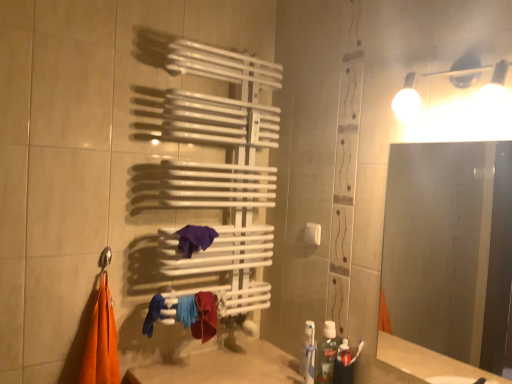
Question: Does frosted glass mirror at right have a smaller size compared to blue fabric at lower center?

Choices:
 (A) yes
 (B) no

Answer: (B)

Question: Considering the relative sizes of frosted glass mirror at right and blue fabric at lower center in the image provided, is frosted glass mirror at right bigger than blue fabric at lower center?

Choices:
 (A) no
 (B) yes

Answer: (B)

Question: Considering the relative sizes of frosted glass mirror at right and blue fabric at lower center in the image provided, is frosted glass mirror at right wider than blue fabric at lower center?

Choices:
 (A) yes
 (B) no

Answer: (B)

Question: Is frosted glass mirror at right thinner than blue fabric at lower center?

Choices:
 (A) no
 (B) yes

Answer: (B)

Question: From a real-world perspective, is frosted glass mirror at right located higher than blue fabric at lower center?

Choices:
 (A) no
 (B) yes

Answer: (B)

Question: Is frosted glass mirror at right further to camera compared to blue fabric at lower center?

Choices:
 (A) yes
 (B) no

Answer: (B)

Question: Does white plastic towel bar at center lie behind translucent plastic toothpaste at lower right?

Choices:
 (A) no
 (B) yes

Answer: (B)

Question: Is translucent plastic toothpaste at lower right inside white plastic towel bar at center?

Choices:
 (A) no
 (B) yes

Answer: (A)

Question: Is white plastic towel bar at center beside translucent plastic toothpaste at lower right?

Choices:
 (A) yes
 (B) no

Answer: (B)

Question: Is white plastic towel bar at center bigger than translucent plastic toothpaste at lower right?

Choices:
 (A) no
 (B) yes

Answer: (A)

Question: Can we say white plastic towel bar at center lies outside translucent plastic toothpaste at lower right?

Choices:
 (A) yes
 (B) no

Answer: (A)

Question: From the image's perspective, is white plastic towel bar at center located above translucent plastic toothpaste at lower right?

Choices:
 (A) no
 (B) yes

Answer: (B)

Question: Considering the relative positions of blue fabric at lower center and frosted glass mirror at right in the image provided, is blue fabric at lower center behind frosted glass mirror at right?

Choices:
 (A) no
 (B) yes

Answer: (B)